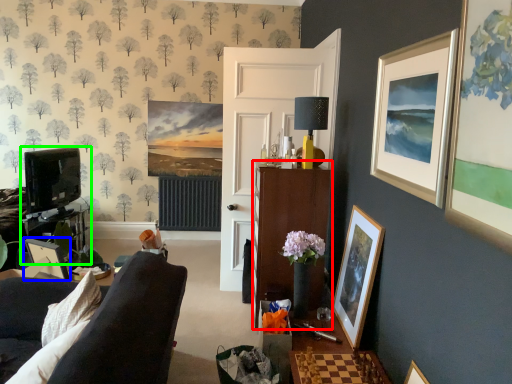
Question: Which object is the closest to the cabinetry (highlighted by a red box)? Choose among these: picture frame (highlighted by a blue box) or entertainment center (highlighted by a green box).

Choices:
 (A) picture frame
 (B) entertainment center

Answer: (A)